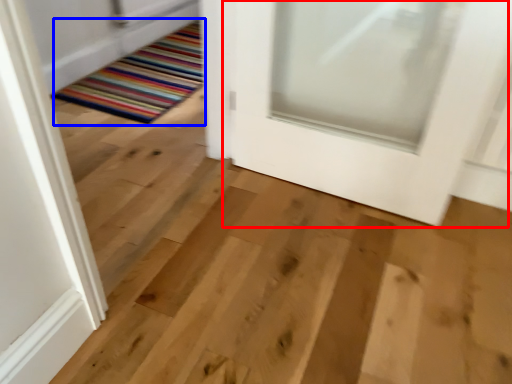
Question: Which point is closer to the camera, door (highlighted by a red box) or mat (highlighted by a blue box)?

Choices:
 (A) door
 (B) mat

Answer: (A)